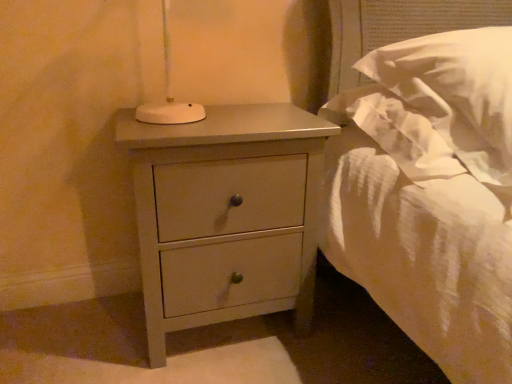
What are the coordinates of `white soft pillow at upper right` in the screenshot? It's located at (456, 89).

Image resolution: width=512 pixels, height=384 pixels. What do you see at coordinates (456, 89) in the screenshot?
I see `white soft pillow at upper right` at bounding box center [456, 89].

Measure the distance between point (245,236) and camera.

1.11 meters.

Where is `matte gray nightstand at lower left`? The height and width of the screenshot is (384, 512). matte gray nightstand at lower left is located at coordinates (227, 207).

Describe the element at coordinates (227, 207) in the screenshot. I see `matte gray nightstand at lower left` at that location.

This screenshot has width=512, height=384. In order to click on white soft pillow at upper right in this screenshot , I will do `click(456, 89)`.

Based on their positions, is matte gray nightstand at lower left located to the left or right of white soft pillow at upper right?

matte gray nightstand at lower left is to the left of white soft pillow at upper right.

Is matte gray nightstand at lower left behind white soft pillow at upper right?

Yes, matte gray nightstand at lower left is behind white soft pillow at upper right.

Considering the positions of point (271, 301) and point (390, 79), is point (271, 301) closer or farther from the camera than point (390, 79)?

Point (271, 301).

From the image's perspective, who appears lower, matte gray nightstand at lower left or white soft pillow at upper right?

matte gray nightstand at lower left is shown below in the image.

From a real-world perspective, is matte gray nightstand at lower left under white soft pillow at upper right?

Yes, from a real-world perspective, matte gray nightstand at lower left is under white soft pillow at upper right.

Does matte gray nightstand at lower left have a lesser width compared to white soft pillow at upper right?

Yes, matte gray nightstand at lower left is thinner than white soft pillow at upper right.

Considering the sizes of objects matte gray nightstand at lower left and white soft pillow at upper right in the image provided, who is taller, matte gray nightstand at lower left or white soft pillow at upper right?

matte gray nightstand at lower left is taller.

Who is smaller, matte gray nightstand at lower left or white soft pillow at upper right?

matte gray nightstand at lower left is smaller.

Choose the correct answer: Is matte gray nightstand at lower left inside white soft pillow at upper right or outside it?

matte gray nightstand at lower left is not enclosed by white soft pillow at upper right.

Is matte gray nightstand at lower left far away from white soft pillow at upper right?

A: No.

Looking at this image, is matte gray nightstand at lower left oriented towards white soft pillow at upper right?

No.

Measure the distance from matte gray nightstand at lower left to white soft pillow at upper right.

matte gray nightstand at lower left is 45.40 centimeters from white soft pillow at upper right.

Locate an element on the screen. This screenshot has width=512, height=384. pillow that appears above the matte gray nightstand at lower left (from the image's perspective) is located at coordinates (456, 89).

Can you confirm if white soft pillow at upper right is positioned to the right of matte gray nightstand at lower left?

Yes.

Consider the image. Relative to matte gray nightstand at lower left, is white soft pillow at upper right in front or behind?

In the image, white soft pillow at upper right appears in front of matte gray nightstand at lower left.

Is point (476, 128) less distant than point (239, 183)?

Yes.

From the image's perspective, is white soft pillow at upper right below matte gray nightstand at lower left?

No.

From a real-world perspective, does white soft pillow at upper right sit lower than matte gray nightstand at lower left?

Incorrect, from a real-world perspective, white soft pillow at upper right is higher than matte gray nightstand at lower left.

From the picture: Considering the relative sizes of white soft pillow at upper right and matte gray nightstand at lower left in the image provided, is white soft pillow at upper right thinner than matte gray nightstand at lower left?

Incorrect, the width of white soft pillow at upper right is not less than that of matte gray nightstand at lower left.

Who is taller, white soft pillow at upper right or matte gray nightstand at lower left?

matte gray nightstand at lower left.

Who is smaller, white soft pillow at upper right or matte gray nightstand at lower left?

Smaller between the two is matte gray nightstand at lower left.

Choose the correct answer: Is white soft pillow at upper right inside matte gray nightstand at lower left or outside it?

The correct answer is: outside.

Consider the image. Are white soft pillow at upper right and matte gray nightstand at lower left making contact?

No, white soft pillow at upper right is not with matte gray nightstand at lower left.

Is white soft pillow at upper right aimed at matte gray nightstand at lower left?

No.

Consider the image. How distant is white soft pillow at upper right from matte gray nightstand at lower left?

17.87 inches.

Identify the location of pillow on the right of matte gray nightstand at lower left. This screenshot has height=384, width=512. (456, 89).

At what (x,y) coordinates should I click in order to perform the action: click on pillow lying on the right of matte gray nightstand at lower left. Please return your answer as a coordinate pair (x, y). The image size is (512, 384). Looking at the image, I should click on (456, 89).

The width and height of the screenshot is (512, 384). In order to click on nightstand located behind the white soft pillow at upper right in this screenshot , I will do `click(227, 207)`.